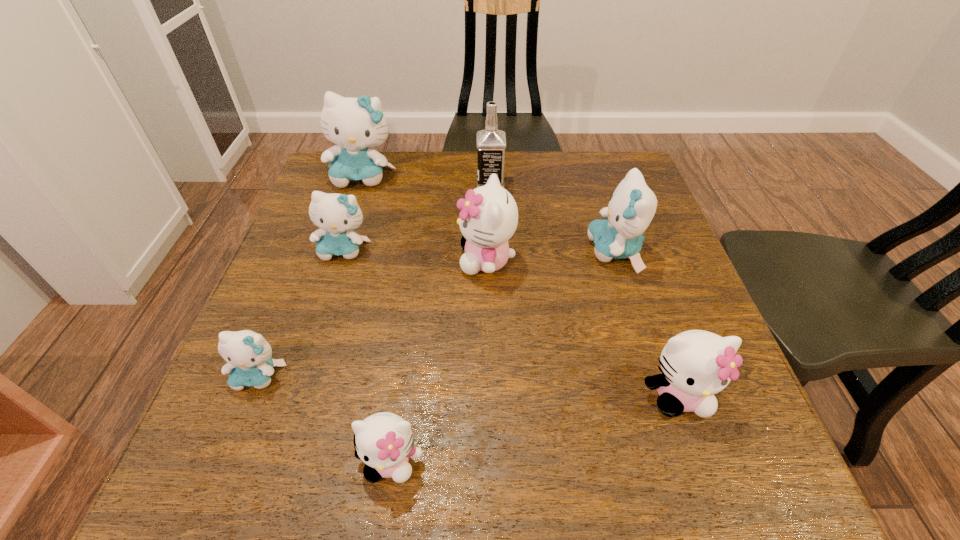
At what (x,y) coordinates should I click in order to perform the action: click on the nearest object. Please return your answer as a coordinate pair (x, y). The width and height of the screenshot is (960, 540). Looking at the image, I should click on (384, 441).

What are the coordinates of `the smallest blue kitten` in the screenshot? It's located at (248, 354).

Image resolution: width=960 pixels, height=540 pixels. What are the coordinates of `vacant area situated 0.390m on the face of the farthest kitten` in the screenshot? It's located at (321, 306).

Identify the location of blank area located on the front label of the vodka. The image size is (960, 540). (410, 184).

In order to click on vacant space located on the front label of the vodka in this screenshot , I will do `click(329, 184)`.

Find the location of a particular element. free space located on the front label of the vodka is located at coordinates click(x=332, y=184).

Find the location of a particular element. Image resolution: width=960 pixels, height=540 pixels. vacant area situated 0.380m on the face of the rightmost blue kitten is located at coordinates (421, 251).

Identify the location of vacant region located 0.180m on the face of the rightmost blue kitten. (509, 251).

This screenshot has width=960, height=540. Find the location of `blank area located on the face of the rightmost blue kitten`. blank area located on the face of the rightmost blue kitten is located at coordinates (514, 251).

This screenshot has height=540, width=960. Find the location of `vacant space located 0.210m on the front-facing side of the third kitten from right to left`. vacant space located 0.210m on the front-facing side of the third kitten from right to left is located at coordinates (365, 260).